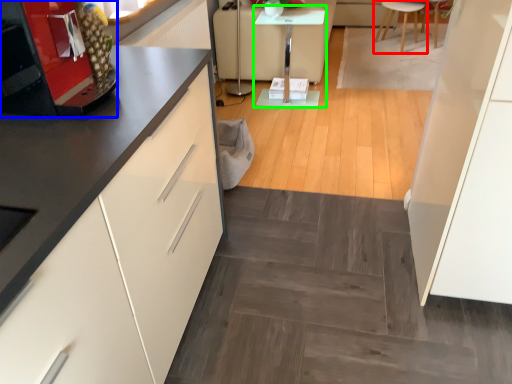
Question: Based on their relative distances, which object is nearer to furniture (highlighted by a red box)? Choose from appliance (highlighted by a blue box) and table (highlighted by a green box).

Choices:
 (A) appliance
 (B) table

Answer: (B)